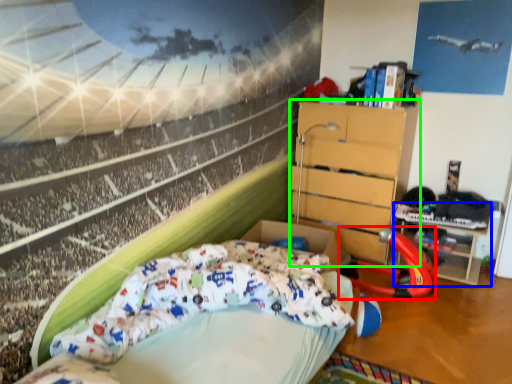
Question: Estimate the real-world distances between objects in this image. Which object is farther from sport equipment (highlighted by a red box), table (highlighted by a blue box) or chest of drawers (highlighted by a green box)?

Choices:
 (A) table
 (B) chest of drawers

Answer: (B)